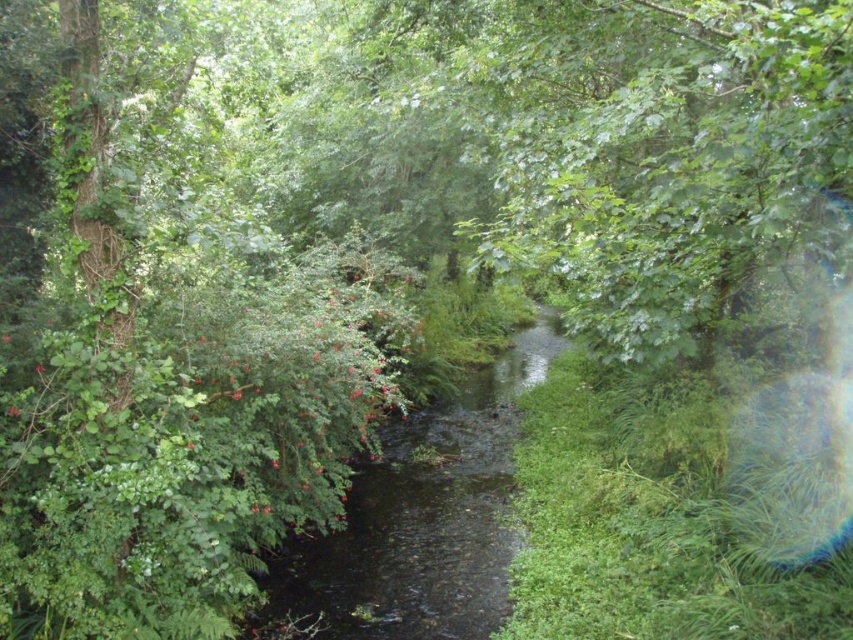
Question: Which point is closer to the camera taking this photo?

Choices:
 (A) (364, 332)
 (B) (36, 372)
 (C) (532, 326)

Answer: (B)

Question: Is green matte bush at center-left below glossy red flower at center-left?

Choices:
 (A) yes
 (B) no

Answer: (A)

Question: Among these objects, which one is farthest from the camera?

Choices:
 (A) green leafy stream at center
 (B) glossy red flower at center-left

Answer: (A)

Question: Does green leafy stream at center appear under glossy red flower at center-left?

Choices:
 (A) yes
 (B) no

Answer: (A)

Question: Which of these objects is positioned farthest from the glossy red flower at center-left?

Choices:
 (A) glossy red flower at left
 (B) green leafy stream at center
 (C) green matte bush at center-left

Answer: (B)

Question: Does green leafy stream at center have a smaller size compared to glossy red flower at center-left?

Choices:
 (A) no
 (B) yes

Answer: (A)